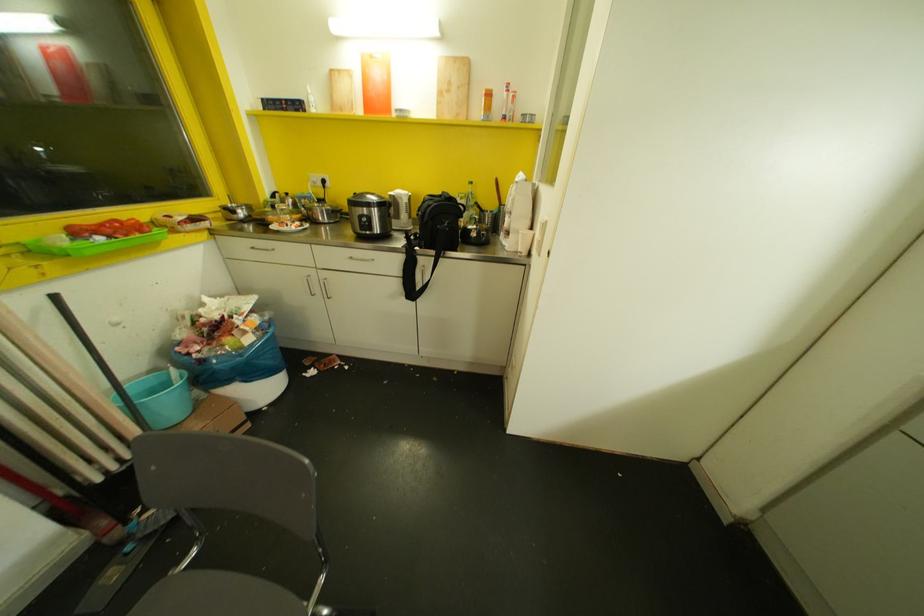
Locate an element on the screen. clear glass bottle is located at coordinates (468, 205).